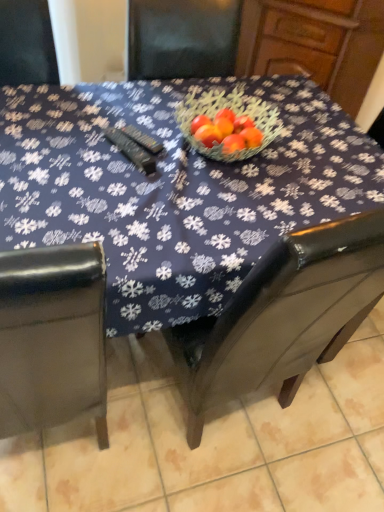
Question: Is blue fabric table at center inside or outside of brown leather chair at lower right?

Choices:
 (A) outside
 (B) inside

Answer: (A)

Question: Considering their positions, is blue fabric table at center located in front of or behind brown leather chair at lower right?

Choices:
 (A) behind
 (B) front

Answer: (B)

Question: Does point (286, 147) appear closer or farther from the camera than point (311, 402)?

Choices:
 (A) farther
 (B) closer

Answer: (B)

Question: Considering the positions of brown leather chair at lower right and blue fabric table at center in the image, is brown leather chair at lower right wider or thinner than blue fabric table at center?

Choices:
 (A) wide
 (B) thin

Answer: (A)

Question: Do you think brown leather chair at lower right is within blue fabric table at center, or outside of it?

Choices:
 (A) outside
 (B) inside

Answer: (A)

Question: Would you say brown leather chair at lower right is to the left or to the right of blue fabric table at center in the picture?

Choices:
 (A) right
 (B) left

Answer: (A)

Question: From the image's perspective, is brown leather chair at lower right above or below blue fabric table at center?

Choices:
 (A) below
 (B) above

Answer: (A)